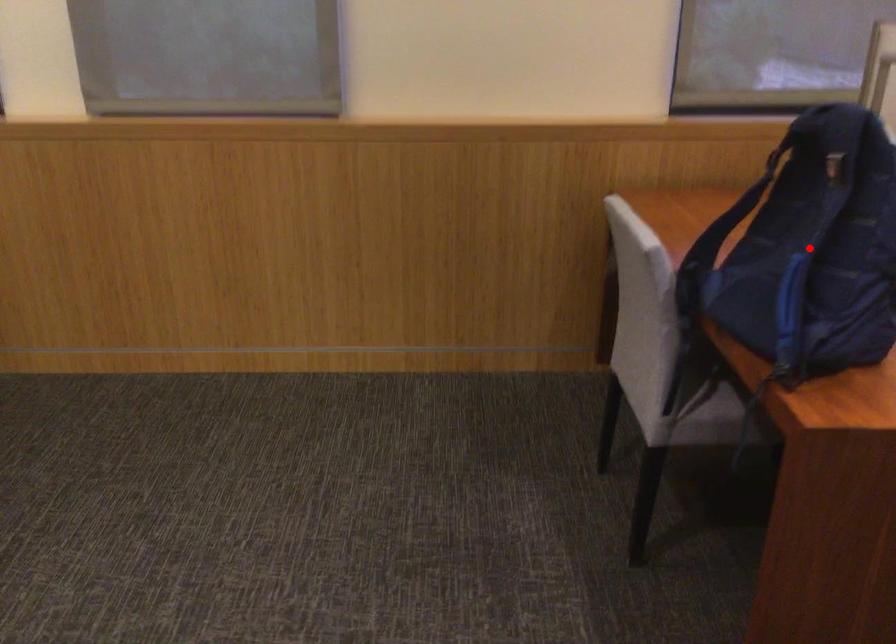
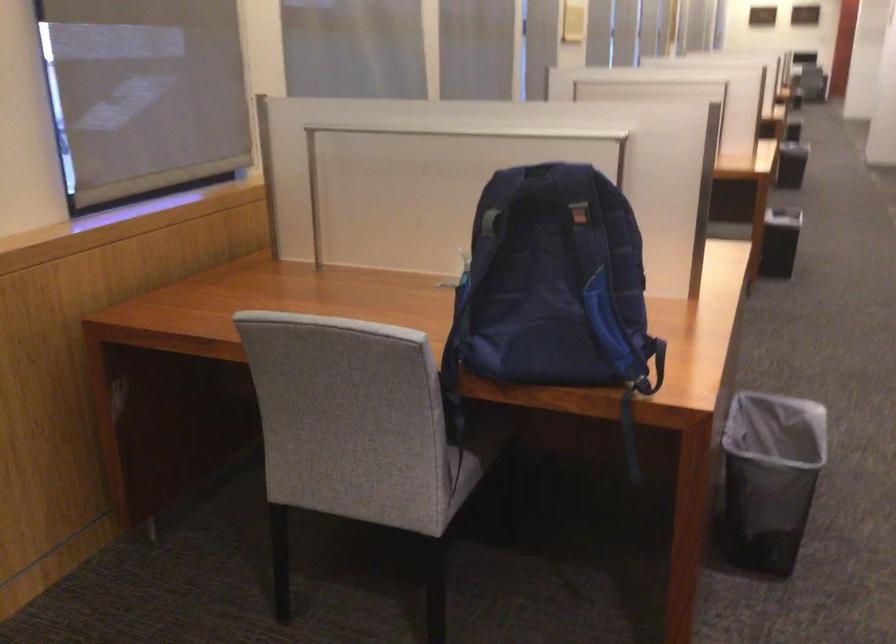
Locate, in the second image, the point that corresponds to the highlighted location in the first image.

(552, 281)